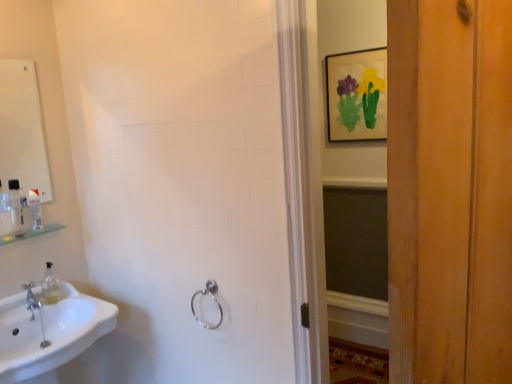
Question: Is white glossy mirror at upper left wider than silver metallic towel ring at lower center?

Choices:
 (A) no
 (B) yes

Answer: (A)

Question: Is white glossy mirror at upper left far away from silver metallic towel ring at lower center?

Choices:
 (A) no
 (B) yes

Answer: (B)

Question: Does white glossy mirror at upper left appear on the right side of silver metallic towel ring at lower center?

Choices:
 (A) yes
 (B) no

Answer: (B)

Question: From a real-world perspective, is white glossy mirror at upper left physically below silver metallic towel ring at lower center?

Choices:
 (A) yes
 (B) no

Answer: (B)

Question: Is white glossy mirror at upper left shorter than silver metallic towel ring at lower center?

Choices:
 (A) no
 (B) yes

Answer: (A)

Question: From the image's perspective, relative to clear plastic bottle at upper left, placed as the first toiletry when sorted from front to back, is white glossy mirror at upper left above or below?

Choices:
 (A) above
 (B) below

Answer: (A)

Question: Is white glossy mirror at upper left spatially inside clear plastic bottle at upper left, arranged as the 2th toiletry when viewed from the back, or outside of it?

Choices:
 (A) inside
 (B) outside

Answer: (B)

Question: Is white glossy mirror at upper left in front of or behind clear plastic bottle at upper left, placed as the first toiletry when sorted from front to back, in the image?

Choices:
 (A) front
 (B) behind

Answer: (A)

Question: In terms of size, does white glossy mirror at upper left appear bigger or smaller than clear plastic bottle at upper left, placed as the first toiletry when sorted from front to back?

Choices:
 (A) small
 (B) big

Answer: (B)

Question: From a real-world perspective, is clear plastic bottle at upper left, placed as the first toiletry when sorted from front to back, above or below white glossy mirror at upper left?

Choices:
 (A) below
 (B) above

Answer: (A)

Question: Considering the positions of clear plastic bottle at upper left, placed as the first toiletry when sorted from front to back, and white glossy mirror at upper left in the image, is clear plastic bottle at upper left, placed as the first toiletry when sorted from front to back, wider or thinner than white glossy mirror at upper left?

Choices:
 (A) thin
 (B) wide

Answer: (B)

Question: Does point (18, 208) appear closer or farther from the camera than point (7, 62)?

Choices:
 (A) closer
 (B) farther

Answer: (A)

Question: Would you say clear plastic bottle at upper left, placed as the first toiletry when sorted from front to back, is to the left or to the right of white glossy mirror at upper left in the picture?

Choices:
 (A) right
 (B) left

Answer: (A)

Question: Based on their sizes in the image, would you say clear plastic bottle at left, which appears as the 1th toiletry when viewed from the back, is bigger or smaller than silver metallic towel ring at lower center?

Choices:
 (A) big
 (B) small

Answer: (B)

Question: Would you say clear plastic bottle at left, which appears as the 1th toiletry when viewed from the back, is inside or outside silver metallic towel ring at lower center?

Choices:
 (A) outside
 (B) inside

Answer: (A)